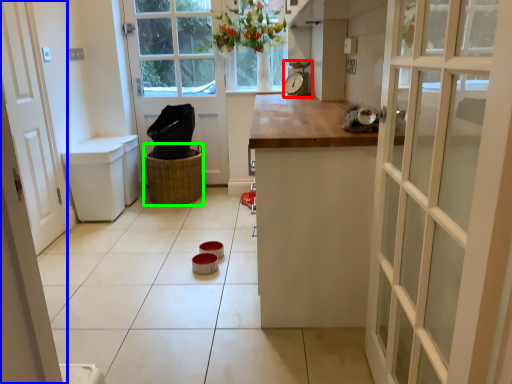
Question: Based on their relative distances, which object is farther from appliance (highlighted by a red box)? Choose from door (highlighted by a blue box) and basket (highlighted by a green box).

Choices:
 (A) door
 (B) basket

Answer: (A)